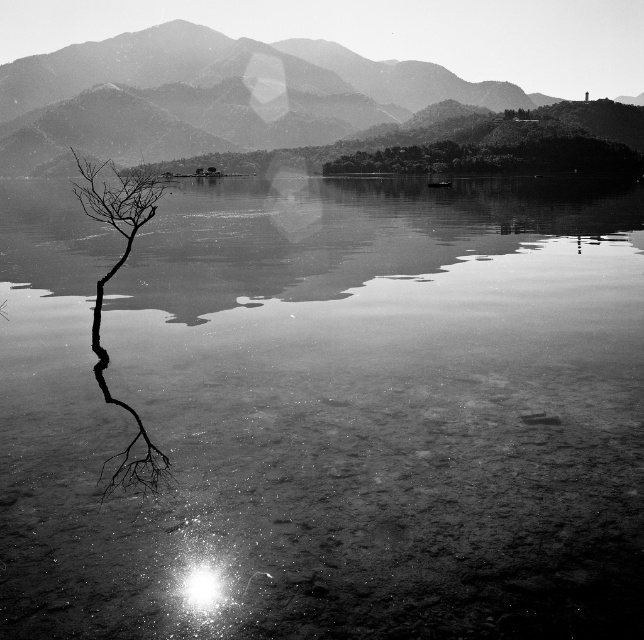
Who is positioned more to the right, smooth stone mountain at upper center or black matte tree at left?

smooth stone mountain at upper center is more to the right.

Who is higher up, smooth stone mountain at upper center or black matte tree at left?

smooth stone mountain at upper center

Is point (164, 77) closer to viewer compared to point (111, 170)?

No.

You are a GUI agent. You are given a task and a screenshot of the screen. Output one action in this format:
    pyautogui.click(x=<x>, y=<y>)
    Task: Click on the smooth stone mountain at upper center
    Image resolution: width=644 pixels, height=640 pixels.
    Given the screenshot: What is the action you would take?
    pyautogui.click(x=213, y=96)

Which is in front, point (562, 198) or point (296, 124)?

Point (562, 198)

Can you confirm if smooth water at center is positioned above smooth stone mountain at upper center?

Incorrect, smooth water at center is not positioned above smooth stone mountain at upper center.

Does point (460, 356) come in front of point (180, 108)?

Yes, point (460, 356) is closer to viewer.

Where is `smooth water at center`? The width and height of the screenshot is (644, 640). smooth water at center is located at coordinates (330, 410).

Is smooth water at center positioned at the back of black matte tree at left?

No, smooth water at center is closer to the viewer.

Which of these two, smooth water at center or black matte tree at left, stands taller?

black matte tree at left is taller.

In order to click on smooth water at center in this screenshot , I will do `click(330, 410)`.